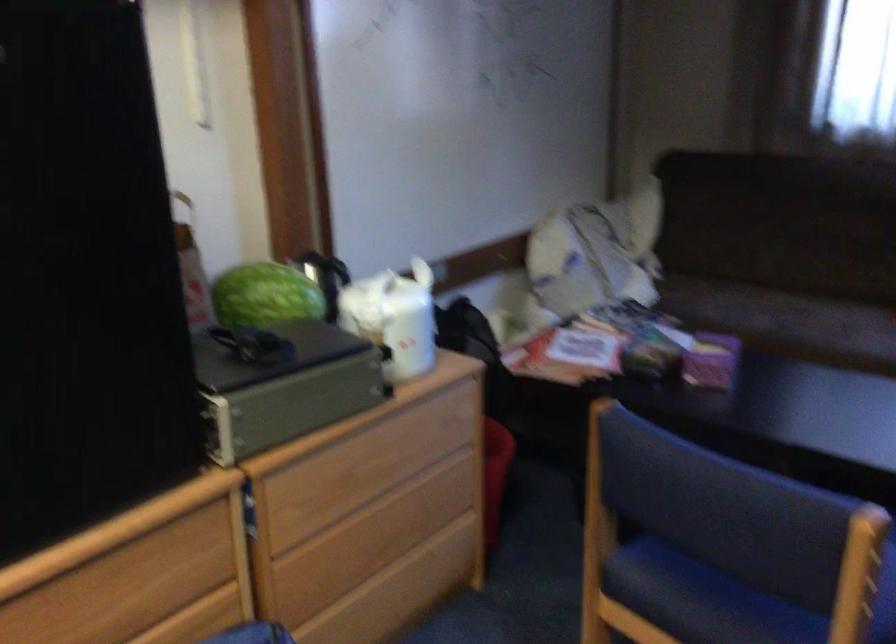
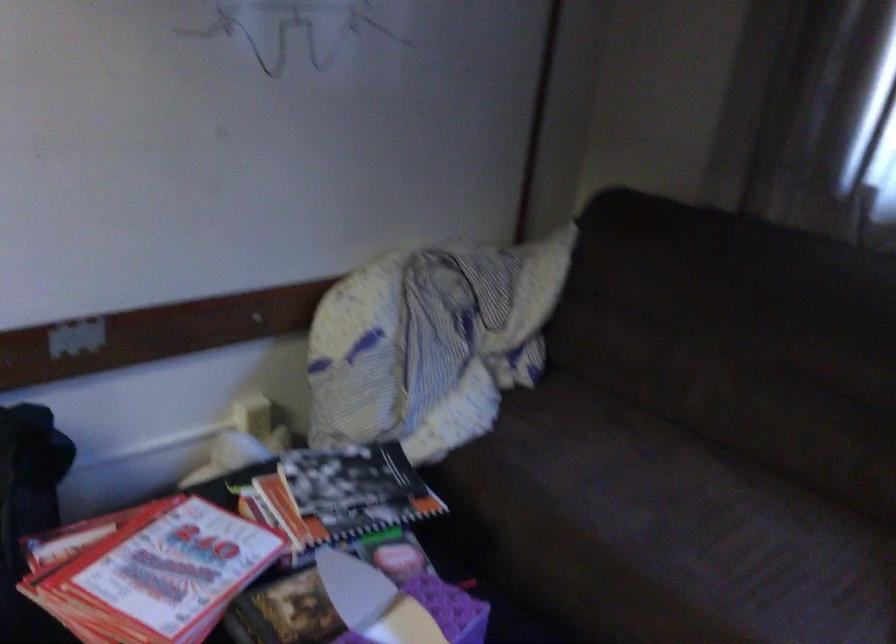
Which direction would the cameraman need to move to produce the second image?

The cameraman walked toward right, forward.